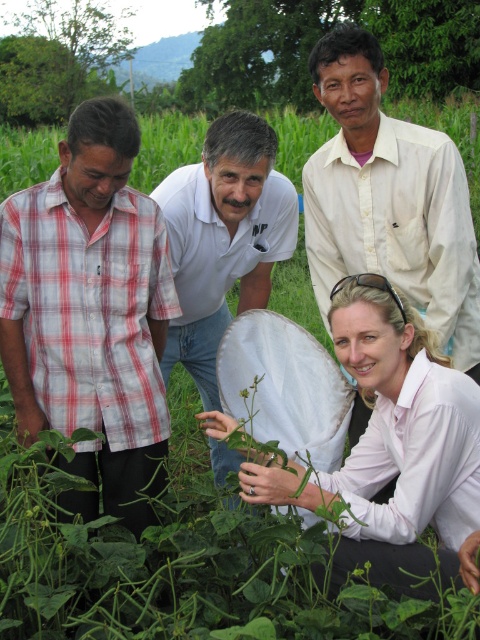
Question: Which of the following is the farthest from the observer?

Choices:
 (A) (314, 81)
 (B) (203, 193)
 (C) (470, 474)
 (D) (119, 436)

Answer: (A)

Question: Which object is positioned closest to the red plaid shirt at left?

Choices:
 (A) pink smooth shirt at lower center
 (B) white shirt at upper center

Answer: (A)

Question: Is red plaid shirt at left wider than white smooth shirt at center?

Choices:
 (A) no
 (B) yes

Answer: (A)

Question: Considering the relative positions of pink smooth shirt at lower center and white shirt at upper center in the image provided, where is pink smooth shirt at lower center located with respect to white shirt at upper center?

Choices:
 (A) right
 (B) left

Answer: (B)

Question: Which of the following is the farthest from the observer?

Choices:
 (A) (424, 476)
 (B) (225, 140)
 (C) (414, 172)
 (D) (135, 250)

Answer: (C)

Question: Does pink smooth shirt at lower center appear on the left side of white smooth shirt at center?

Choices:
 (A) yes
 (B) no

Answer: (B)